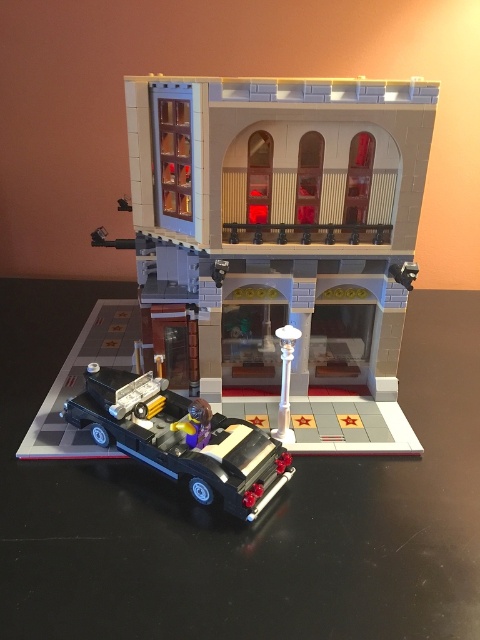
Question: Is matte gray building at center above black plastic car at lower left?

Choices:
 (A) yes
 (B) no

Answer: (A)

Question: Which of the following is the closest to the observer?

Choices:
 (A) black plastic car at lower left
 (B) matte gray building at center

Answer: (A)

Question: Can you confirm if matte gray building at center is bigger than black plastic car at lower left?

Choices:
 (A) yes
 (B) no

Answer: (A)

Question: Does matte gray building at center come behind black plastic car at lower left?

Choices:
 (A) yes
 (B) no

Answer: (A)

Question: Which of the following is the closest to the observer?

Choices:
 (A) (120, 429)
 (B) (373, 216)

Answer: (A)